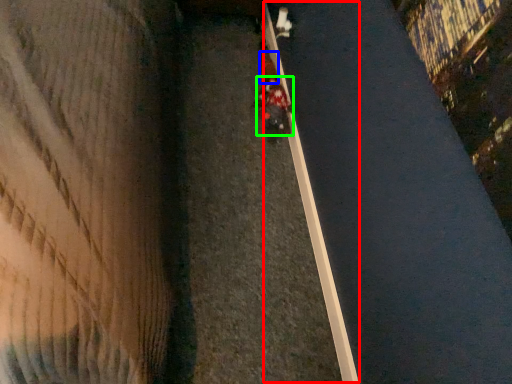
Question: Which is nearer to the curb (highlighted by a red box)? pedestrian (highlighted by a blue box) or person (highlighted by a green box).

Choices:
 (A) pedestrian
 (B) person

Answer: (B)